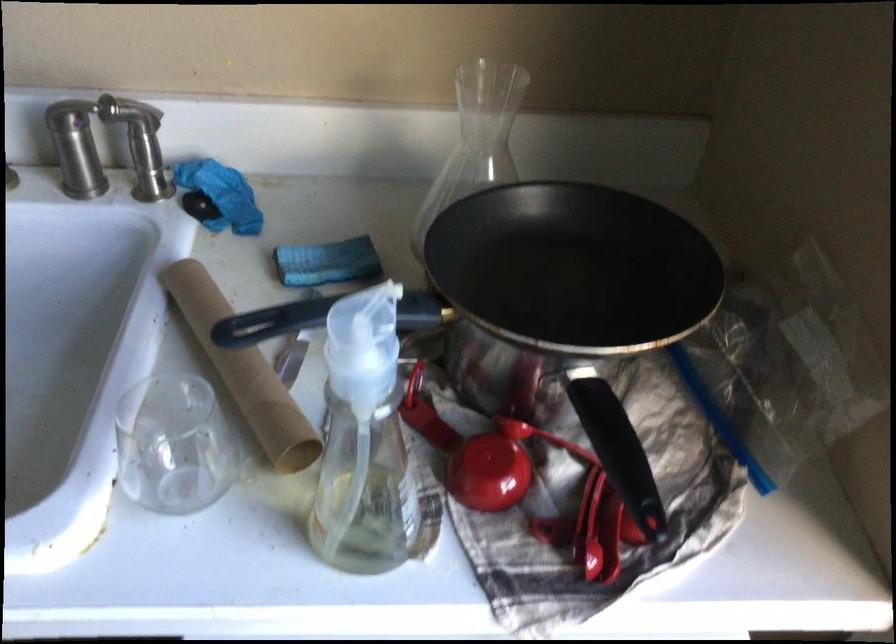
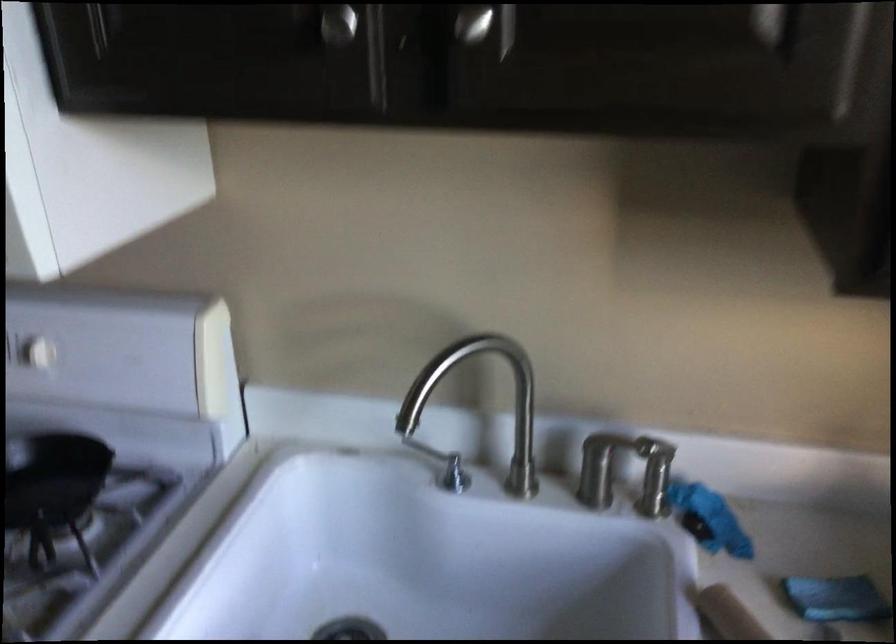
Where in the second image is the point corresponding to the point at 85,147 from the first image?

(606, 465)